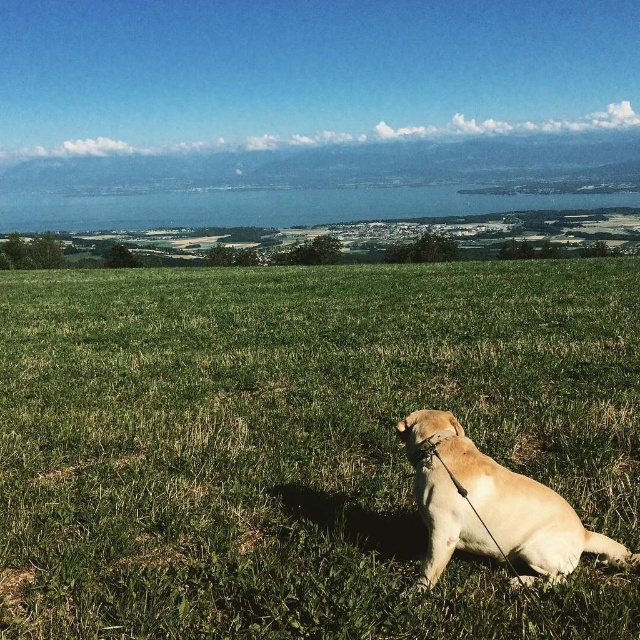
Who is shorter, green grassy field at center or golden fur dog at lower right?

golden fur dog at lower right is shorter.

Is point (364, 396) positioned behind point (620, 564)?

Yes, it is behind point (620, 564).

Image resolution: width=640 pixels, height=640 pixels. I want to click on green grassy field at center, so click(x=292, y=440).